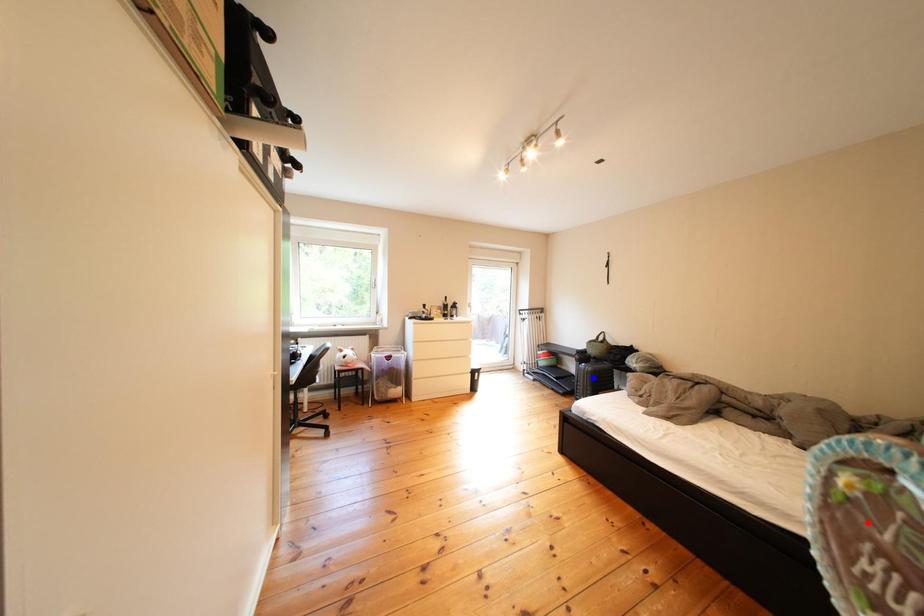
Question: Two points are marked on the image. Which point is closer to the camera?

Choices:
 (A) Blue point is closer.
 (B) Red point is closer.

Answer: (B)